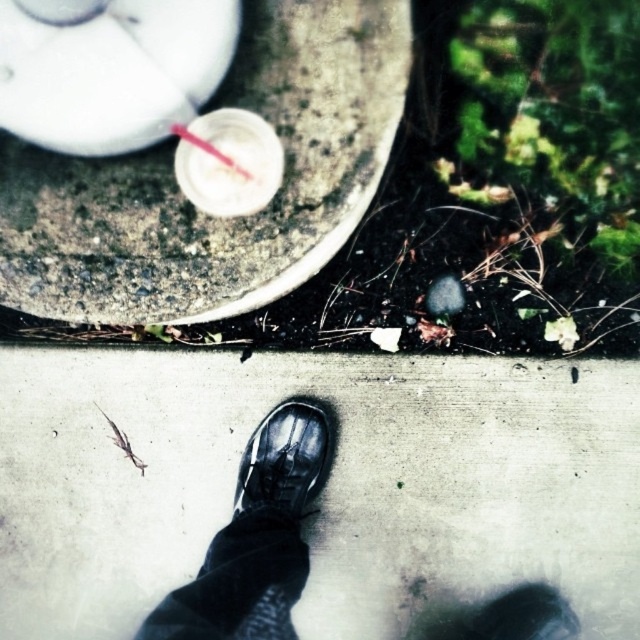
In the scene shown: You are standing at the edge of the pavement where the black leather shoe is placed. You want to walk towards the blurred green area in the background. Which direction should you move relative to the point at coordinate (324, 486)?

The point at coordinate (324, 486) corresponds to the matte concrete sidewalk at center. Since the blurred green area is in the background, you should move away from the point towards the direction opposite of the point to reach the green area.

You are a delivery robot navigating a sidewalk. You see the matte concrete sidewalk at center and the clear plastic straw at center. Which object is closer to the ground?

The matte concrete sidewalk at center is positioned under the clear plastic straw at center, so the sidewalk is closer to the ground.

You are a delivery robot navigating a sidewalk. You need to place a package on the matte concrete sidewalk at center. According to the image, where exactly should you place the package?

The matte concrete sidewalk at center is located at point (324, 486), so place the package there.